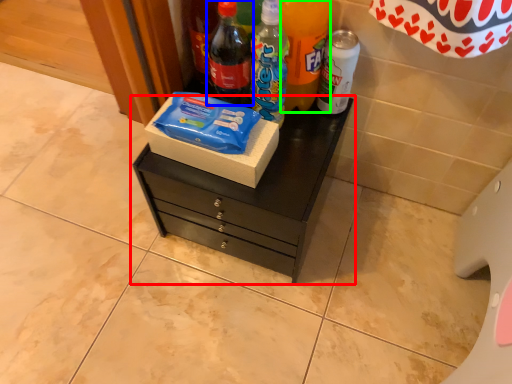
Question: Considering the real-world distances, which object is closest to chest of drawers (highlighted by a red box)? bottle (highlighted by a blue box) or bottle (highlighted by a green box).

Choices:
 (A) bottle
 (B) bottle

Answer: (A)